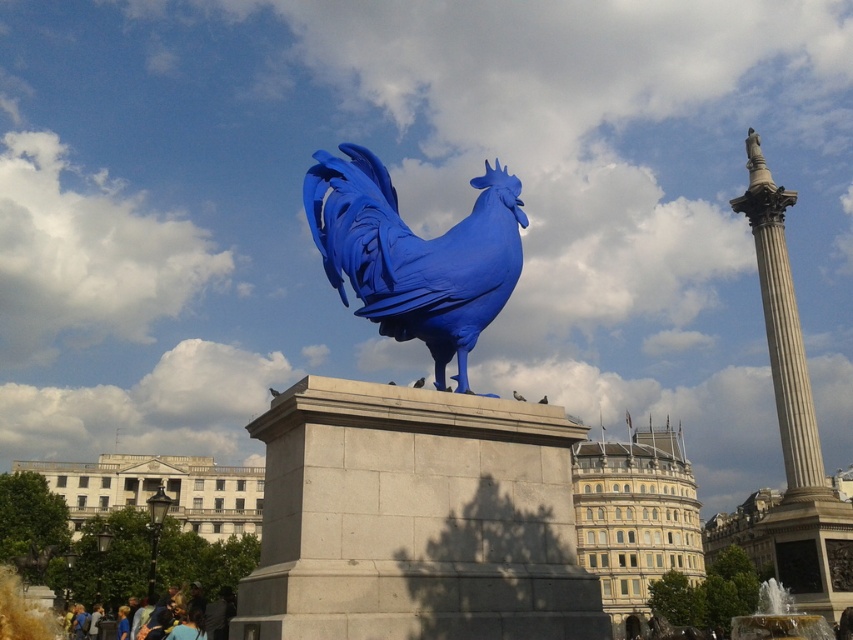
You are standing in a public square and see the matte blue rooster at center. If you were to draw a straight line from your current position to the base of the rooster, would it pass directly through the rooster itself?

The matte blue rooster at center is positioned at point [415,253]. Since the question specifies drawing a line from your position to the base of the rooster, the line would naturally pass through the rooster itself as it is the central object in the scene.

You are an architect designing a new public square and want to ensure the smooth stone pedestal at center can support the matte blue rooster at center. Given that the pedestal is shorter than the rooster, would the rooster be visible from a distance? Explain your reasoning.

The smooth stone pedestal at center has a lesser height compared to matte blue rooster at center, so the rooster would be visible from a distance because its height exceeds the pedestal, making it stand out.

You are standing in the public square and see the blue rooster sculpture. There is a point marked at coordinates (415, 518). According to the image, where is this point located?

The point at coordinates (415, 518) is on the smooth stone pedestal at center, which supports the blue rooster sculpture.